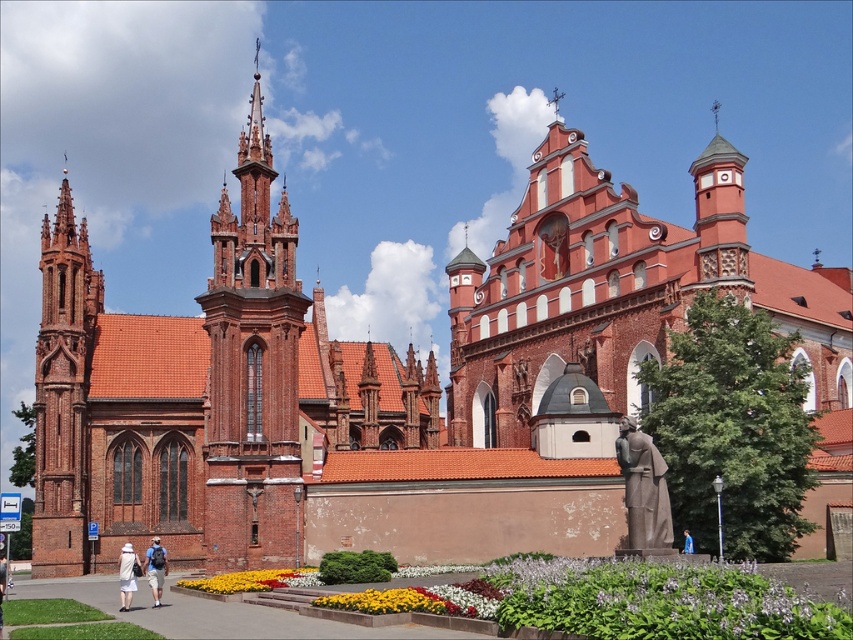
Describe the element at coordinates (155, 568) in the screenshot. I see `light brown backpack at lower left` at that location.

Does point (161, 554) come closer to viewer compared to point (120, 595)?

Yes, it is in front of point (120, 595).

Locate an element on the screen. light brown backpack at lower left is located at coordinates (155, 568).

This screenshot has width=853, height=640. In order to click on light brown backpack at lower left in this screenshot , I will do `click(155, 568)`.

Between point (271, 330) and point (250, 579), which one is positioned in front?

Point (250, 579)

Is red brick tower at center shorter than yellow matte flowers at center?

In fact, red brick tower at center may be taller than yellow matte flowers at center.

Between point (283, 225) and point (219, 593), which one is positioned in front?

Point (219, 593) is in front.

The width and height of the screenshot is (853, 640). Find the location of `red brick tower at center`. red brick tower at center is located at coordinates (253, 369).

Does point (640, 497) lie in front of point (126, 573)?

No, it is behind (126, 573).

You are a GUI agent. You are given a task and a screenshot of the screen. Output one action in this format:
    pyautogui.click(x=<x>, y=<y>)
    Task: Click on the bronze statue at lower right
    The image size is (853, 640).
    Given the screenshot: What is the action you would take?
    pyautogui.click(x=643, y=490)